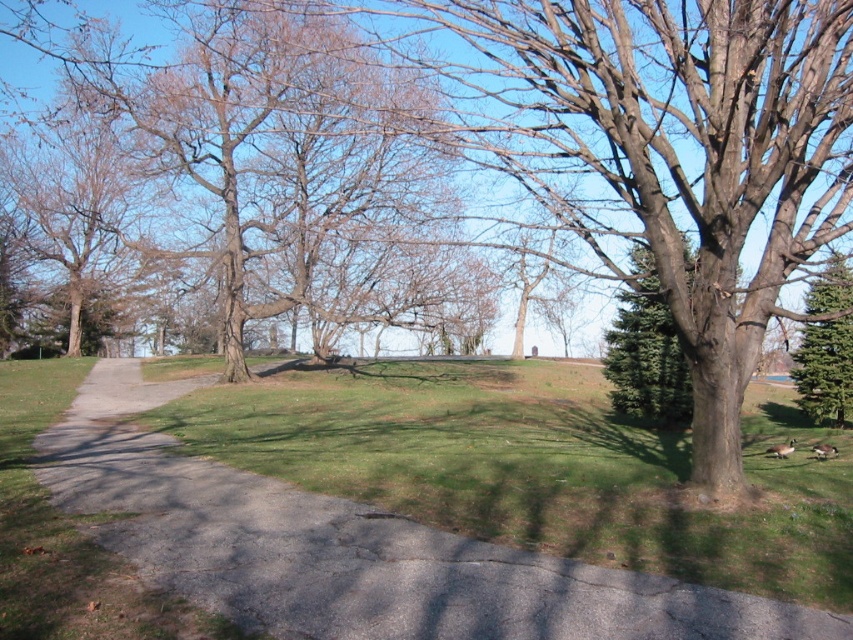
Question: Which object is the closest to the gray asphalt path at center?

Choices:
 (A) green textured evergreen at right
 (B) green textured evergreen tree at right

Answer: (A)

Question: Does green textured evergreen at right appear on the left side of green textured evergreen tree at right?

Choices:
 (A) yes
 (B) no

Answer: (A)

Question: Which of the following is the closest to the observer?

Choices:
 (A) green textured evergreen at right
 (B) gray asphalt path at center
 (C) green textured evergreen tree at right

Answer: (B)

Question: Is gray asphalt path at center positioned in front of green textured evergreen at right?

Choices:
 (A) no
 (B) yes

Answer: (B)

Question: Which point is farther to the camera?

Choices:
 (A) (809, 337)
 (B) (614, 637)
 (C) (653, 326)

Answer: (A)

Question: Is gray asphalt path at center closer to camera compared to green textured evergreen tree at right?

Choices:
 (A) yes
 (B) no

Answer: (A)